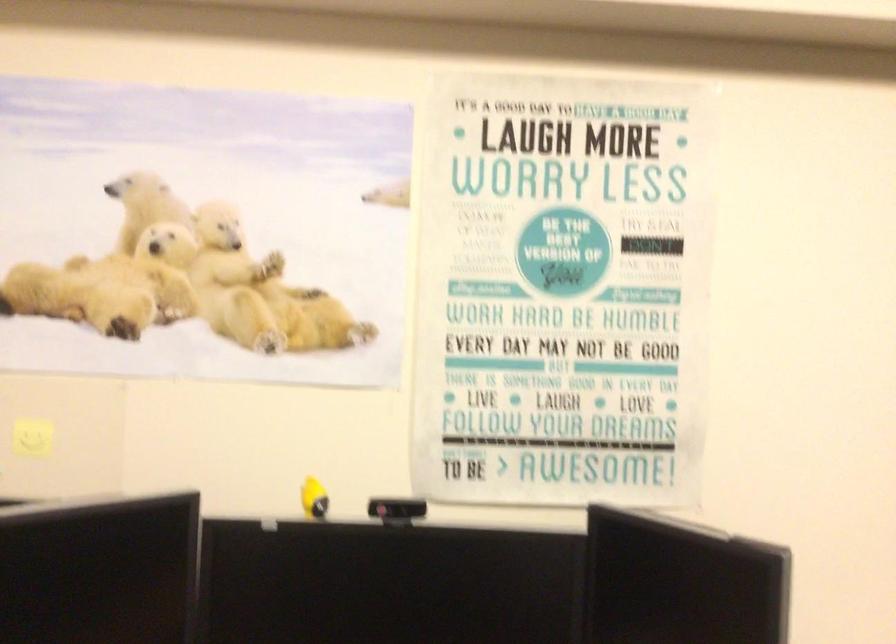
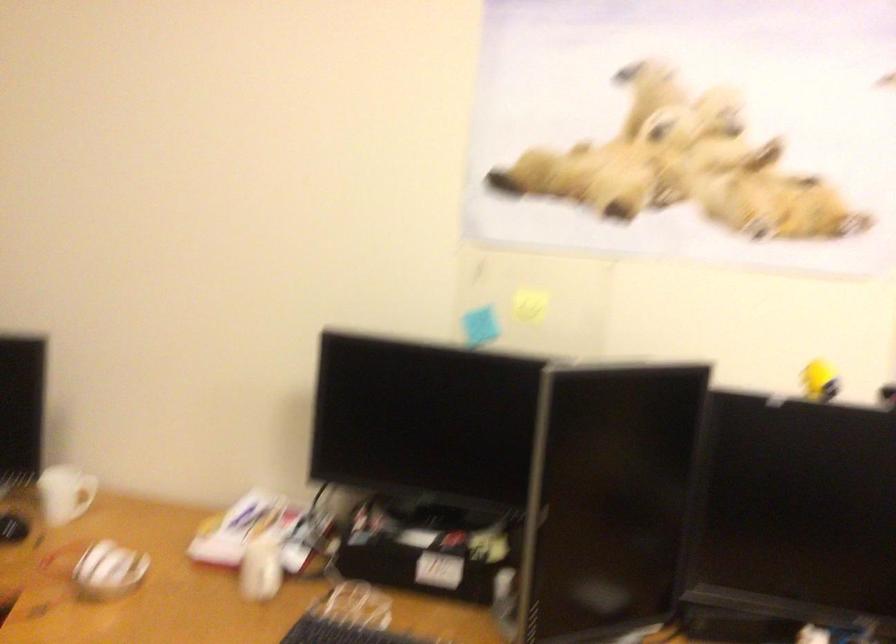
Question: Based on the continuous images, in which direction is the camera rotating? Reply with the corresponding letter.

Choices:
 (A) Left
 (B) Right
 (C) Up
 (D) Down

Answer: (A)